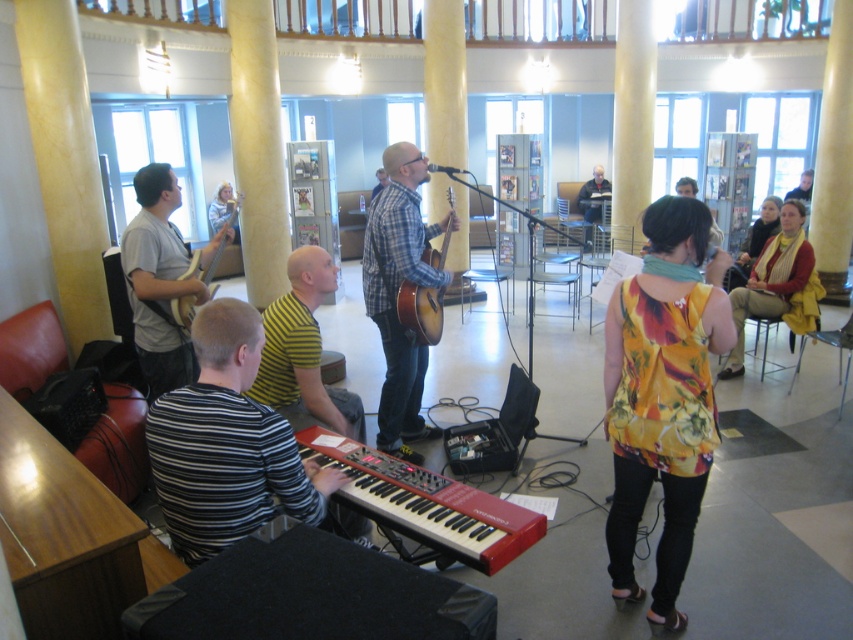
Based on the photo, you are a photographer setting up for a live music shoot. You need to position a light source between the striped fabric keyboard at lower left and the yellow striped shirt at center. Based on the scene description, where should you place the light source relative to these two objects?

The striped fabric keyboard at lower left is located above the yellow striped shirt at center, so the light source should be placed between them by positioning it below the keyboard and above the shirt.

You are a photographer setting up for a live music shoot. You need to ensure that the floral print blouse at center and the red matte keyboard at lower center are both in focus. Based on their positions, which object is closer to the camera and might require adjusting the focus first?

The floral print blouse at center is positioned over the red matte keyboard at lower center, meaning it is closer to the camera. Adjust the focus on the floral print blouse at center first to ensure both are in focus.